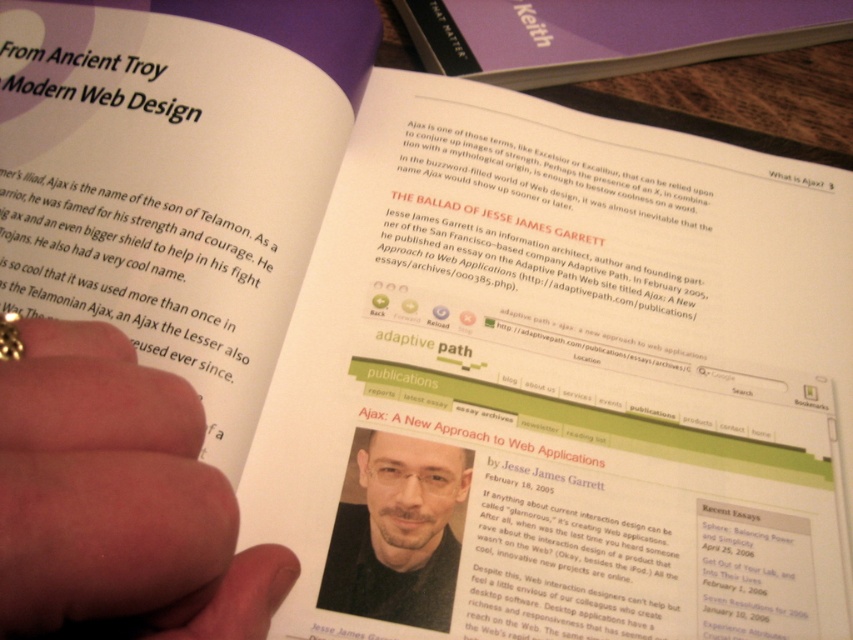
Who is more forward, (113, 552) or (361, 436)?

Point (113, 552) is more forward.

Does flesh-toned skin at center lie in front of smooth skin portrait at center?

Yes.

Measure the distance between point (67, 364) and camera.

11.15 inches

I want to click on flesh-toned skin at center, so click(x=117, y=499).

Does purple matte book at upper center have a greater height compared to smooth skin portrait at center?

Yes.

Does purple matte book at upper center appear on the left side of smooth skin portrait at center?

In fact, purple matte book at upper center is to the right of smooth skin portrait at center.

Is point (474, 22) behind point (469, 452)?

Yes, it is behind point (469, 452).

Where is `purple matte book at upper center`? Image resolution: width=853 pixels, height=640 pixels. purple matte book at upper center is located at coordinates (606, 35).

Does flesh-toned skin at center have a greater width compared to purple matte book at upper center?

In fact, flesh-toned skin at center might be narrower than purple matte book at upper center.

Is point (65, 346) less distant than point (657, 38)?

Yes, it is in front of point (657, 38).

Image resolution: width=853 pixels, height=640 pixels. Describe the element at coordinates (117, 499) in the screenshot. I see `flesh-toned skin at center` at that location.

The width and height of the screenshot is (853, 640). I want to click on flesh-toned skin at center, so click(x=117, y=499).